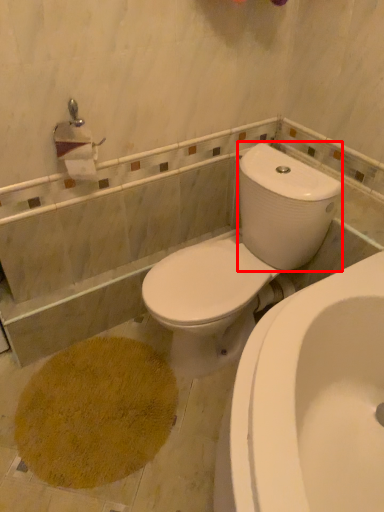
Question: Observing the image, what is the correct spatial positioning of water tank (annotated by the red box) in reference to toilet?

Choices:
 (A) right
 (B) left

Answer: (A)